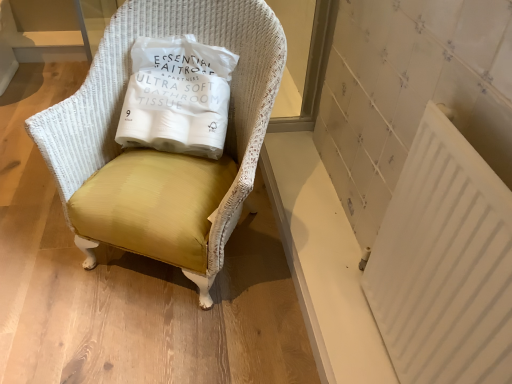
Question: Is white plastic radiator at lower right in front of or behind matte yellow fabric chair at center in the image?

Choices:
 (A) behind
 (B) front

Answer: (B)

Question: From a real-world perspective, is white plastic radiator at lower right positioned above or below matte yellow fabric chair at center?

Choices:
 (A) below
 (B) above

Answer: (B)

Question: Which object is positioned closest to the white paper bag at center?

Choices:
 (A) matte yellow fabric chair at center
 (B) white plastic radiator at lower right

Answer: (A)

Question: Which is farther from the matte yellow fabric chair at center?

Choices:
 (A) white plastic radiator at lower right
 (B) white paper bag at center

Answer: (A)